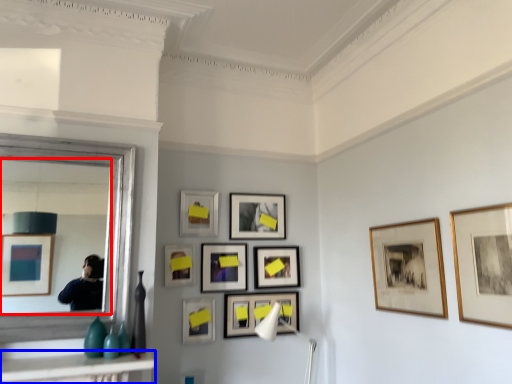
Question: Among these objects, which one is farthest to the camera, mirror (highlighted by a red box) or table (highlighted by a blue box)?

Choices:
 (A) mirror
 (B) table

Answer: (A)